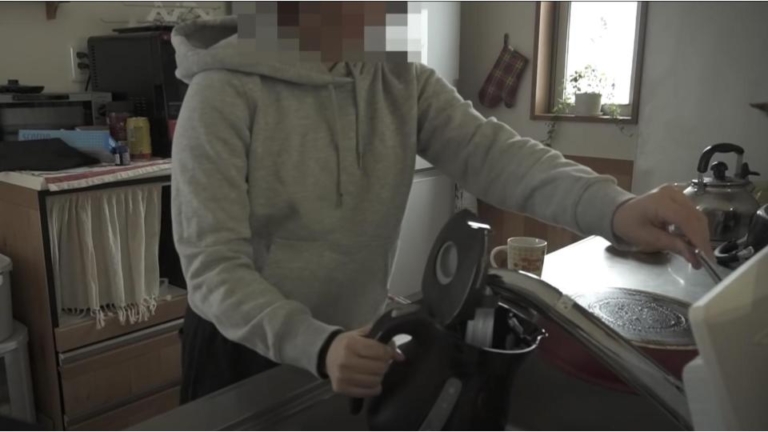
The width and height of the screenshot is (768, 432). In order to click on faucet handle in this screenshot , I will do `click(709, 264)`.